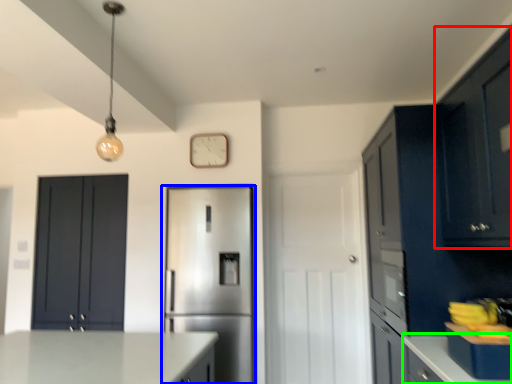
Question: Which is nearer to the cabinetry (highlighted by a red box)? refrigerator (highlighted by a blue box) or counter top (highlighted by a green box).

Choices:
 (A) refrigerator
 (B) counter top

Answer: (B)